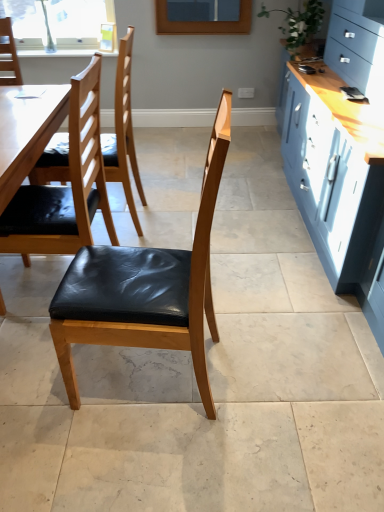
What are the coordinates of `free space in front of matte black leather chair at center, positioned as the 3th chair in back-to-front order` in the screenshot? It's located at (139, 457).